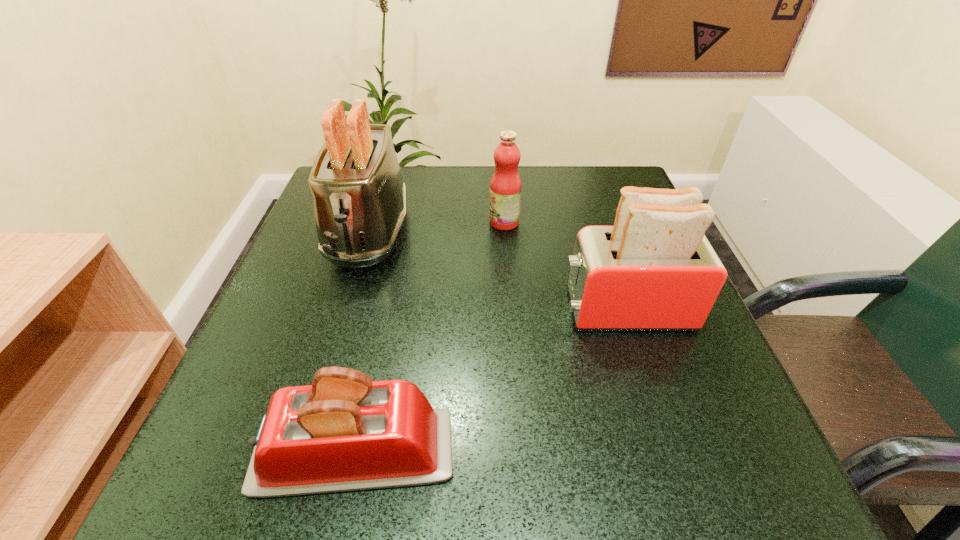
Identify the location of the farthest toaster. (359, 198).

Find the location of a particular element. Image resolution: width=960 pixels, height=540 pixels. the second farthest toaster is located at coordinates (654, 270).

The image size is (960, 540). What are the coordinates of `the second nearest object` in the screenshot? It's located at (654, 270).

I want to click on fruit juice, so click(505, 187).

Identify the location of the shortest object. Image resolution: width=960 pixels, height=540 pixels. [x=345, y=432].

The width and height of the screenshot is (960, 540). I want to click on the nearest object, so click(345, 432).

The image size is (960, 540). Identify the location of vacant space located 0.110m on the side of the farthest toaster with the control lever. (x=342, y=323).

Find the location of a particular element. This screenshot has width=960, height=540. vacant space situated on the front-facing side of the second shortest toaster is located at coordinates (363, 309).

This screenshot has width=960, height=540. I want to click on free space located 0.170m on the front-facing side of the second shortest toaster, so coord(468,309).

The image size is (960, 540). Find the location of `free location located 0.360m on the front-facing side of the second shortest toaster`. free location located 0.360m on the front-facing side of the second shortest toaster is located at coordinates (363, 309).